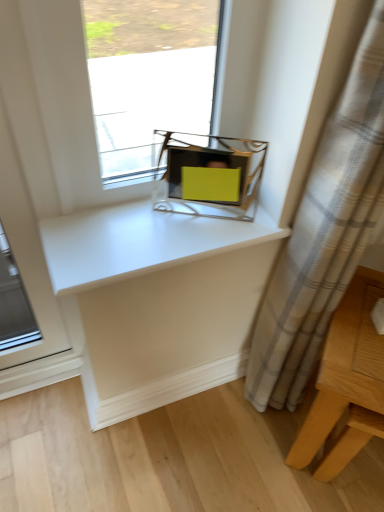
Question: Does light wood table at lower right have a lesser height compared to white glossy counter top at center?

Choices:
 (A) no
 (B) yes

Answer: (A)

Question: Is light wood table at lower right further to the viewer compared to white glossy counter top at center?

Choices:
 (A) no
 (B) yes

Answer: (A)

Question: Can white glossy counter top at center be found inside light wood table at lower right?

Choices:
 (A) yes
 (B) no

Answer: (B)

Question: From a real-world perspective, is light wood table at lower right physically above white glossy counter top at center?

Choices:
 (A) no
 (B) yes

Answer: (A)

Question: Does light wood table at lower right turn towards white glossy counter top at center?

Choices:
 (A) no
 (B) yes

Answer: (A)

Question: Considering the relative sizes of light wood table at lower right and white glossy counter top at center in the image provided, is light wood table at lower right smaller than white glossy counter top at center?

Choices:
 (A) yes
 (B) no

Answer: (B)

Question: Can you confirm if light wood table at lower right is positioned to the right of matte yellow plastic at center?

Choices:
 (A) yes
 (B) no

Answer: (A)

Question: From a real-world perspective, is light wood table at lower right positioned over matte yellow plastic at center based on gravity?

Choices:
 (A) no
 (B) yes

Answer: (A)

Question: Does light wood table at lower right lie behind matte yellow plastic at center?

Choices:
 (A) no
 (B) yes

Answer: (A)

Question: Considering the relative sizes of light wood table at lower right and matte yellow plastic at center in the image provided, is light wood table at lower right shorter than matte yellow plastic at center?

Choices:
 (A) yes
 (B) no

Answer: (B)

Question: Considering the relative positions of light wood table at lower right and matte yellow plastic at center in the image provided, is light wood table at lower right in front of matte yellow plastic at center?

Choices:
 (A) no
 (B) yes

Answer: (B)

Question: Does light wood table at lower right have a larger size compared to matte yellow plastic at center?

Choices:
 (A) no
 (B) yes

Answer: (B)

Question: Can you confirm if matte yellow plastic at center is thinner than light wood table at lower right?

Choices:
 (A) yes
 (B) no

Answer: (A)